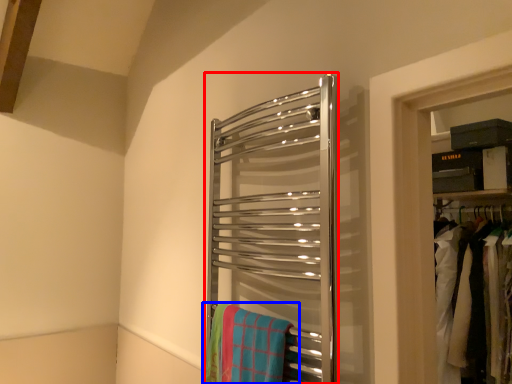
Question: Which of the following is the farthest to the observer, towel rack (highlighted by a red box) or beach towel (highlighted by a blue box)?

Choices:
 (A) towel rack
 (B) beach towel

Answer: (B)